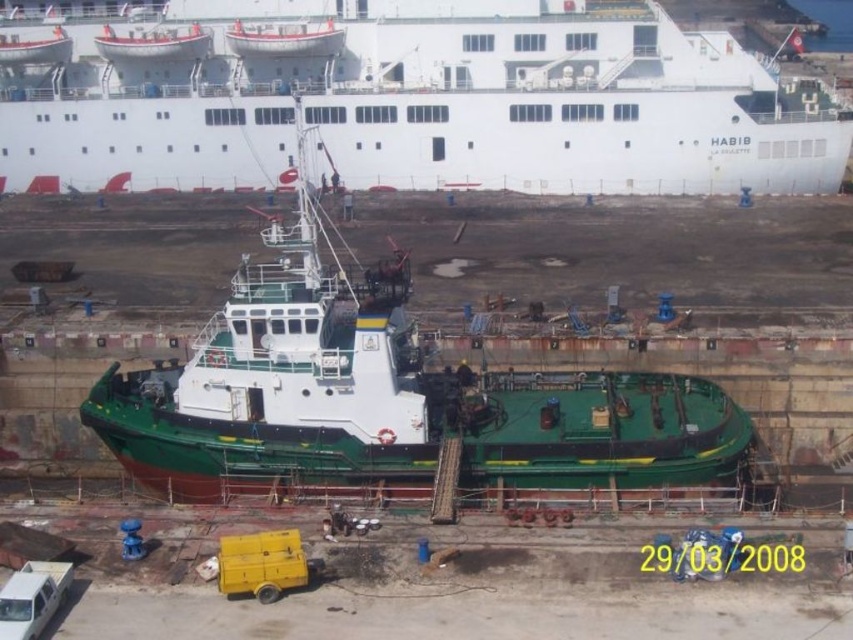
You are standing in the shipyard and want to determine which of the two points, point (215, 339) or point (271, 36), is nearer to you. Based on the scene, which point is closer?

Point (215, 339) is closer to the viewer than point (271, 36).

You are standing at the shipyard and want to take a photo of the tugboat. You notice two points marked on the tugboat deck at coordinates point (421, 115) and point (332, 52). Which point is closer to your camera position?

Point (421, 115) is closer to the camera than point (332, 52).